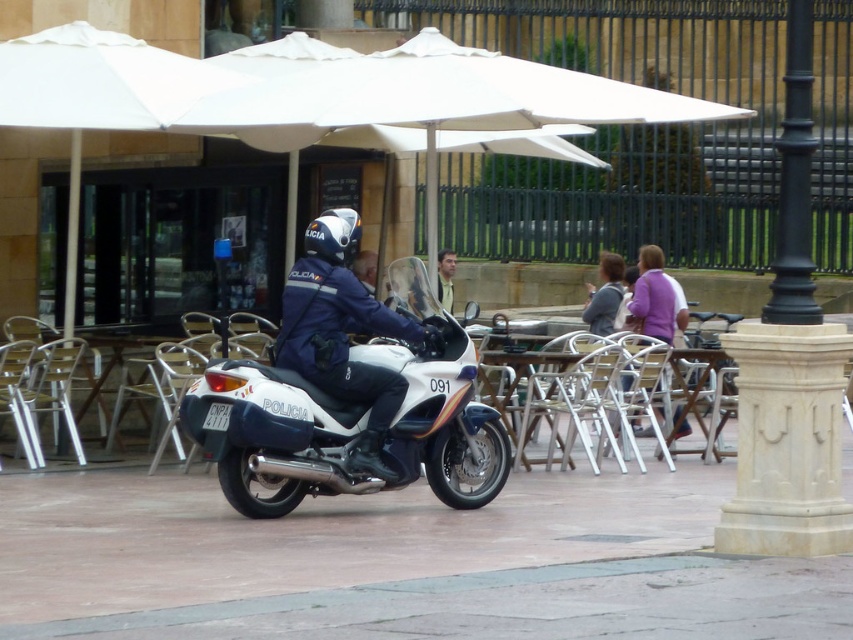
You are a customer at the outdoor cafe and want to find the police officer wearing the blue fabric uniform at center. Where should you look based on the coordinates provided?

The blue fabric uniform at center is located at coordinates point [343,333].

You are a customer at the outdoor cafe and want to decide which clothing item to wear for a photo. The blue fabric uniform at center and the purple sweater at center are both visible in the scene. Which clothing item appears taller when viewed from your perspective?

The blue fabric uniform at center appears taller than the purple sweater at center.